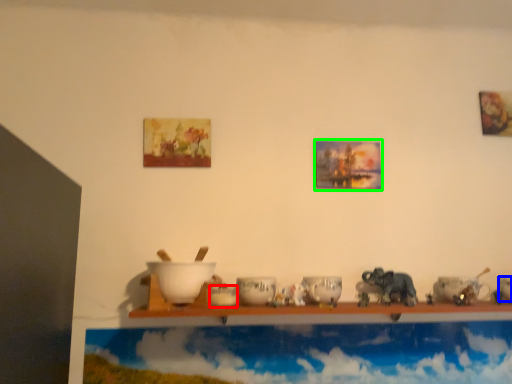
Question: Which object is the farthest from tableware (highlighted by a red box)? Choose among these: tableware (highlighted by a blue box) or picture frame (highlighted by a green box).

Choices:
 (A) tableware
 (B) picture frame

Answer: (A)